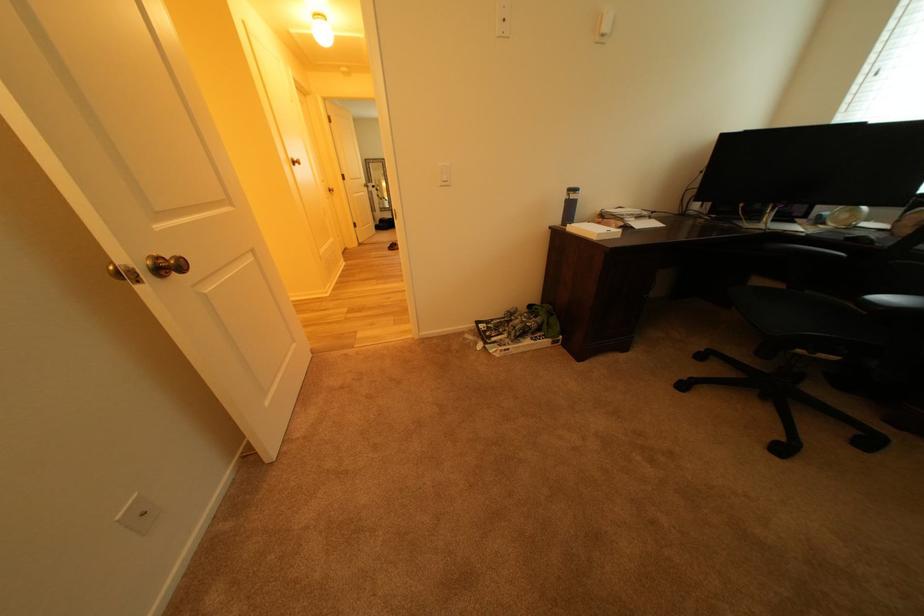
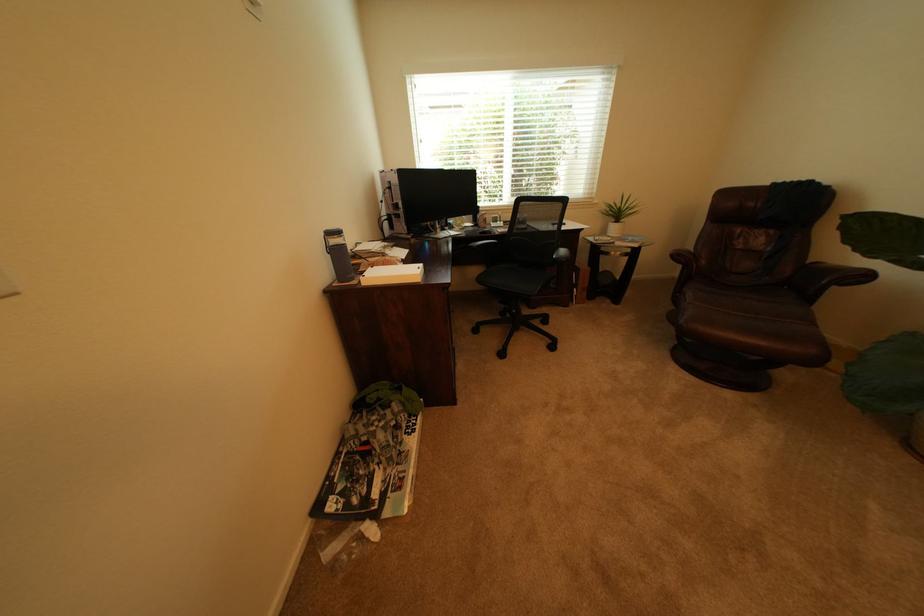
The point at (581, 200) is marked in the first image. Where is the corresponding point in the second image?

(342, 246)